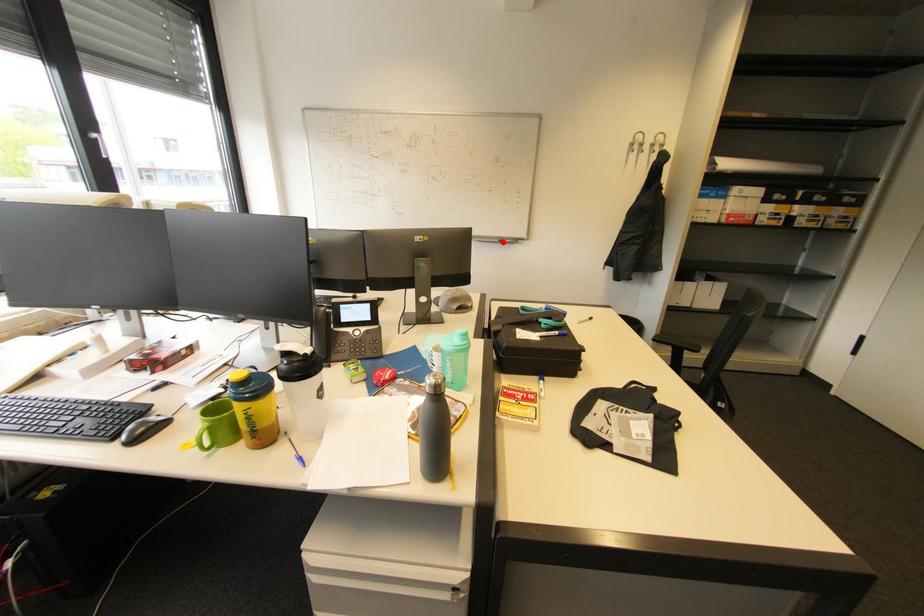
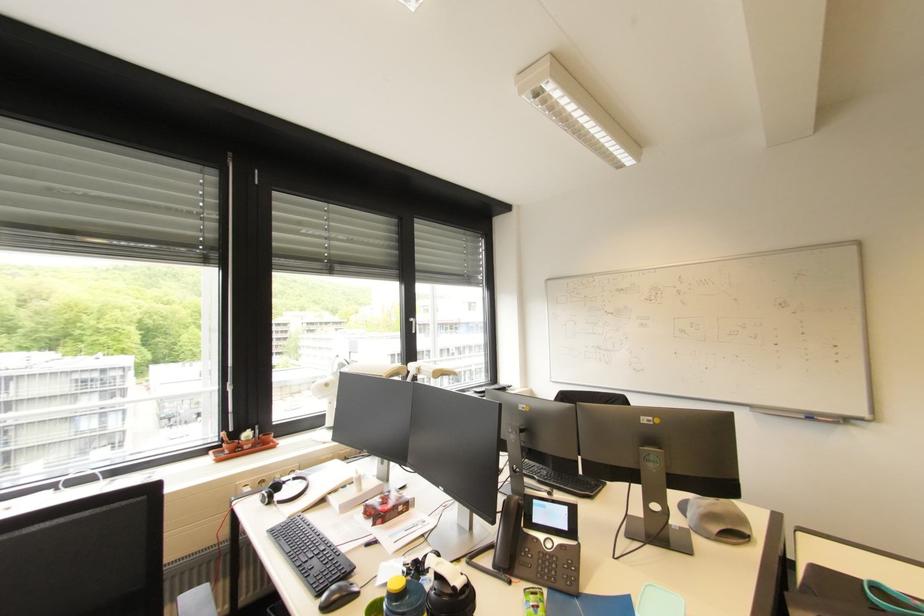
Find the pixel in the second image that matches the highlighted location in the first image.

(808, 418)